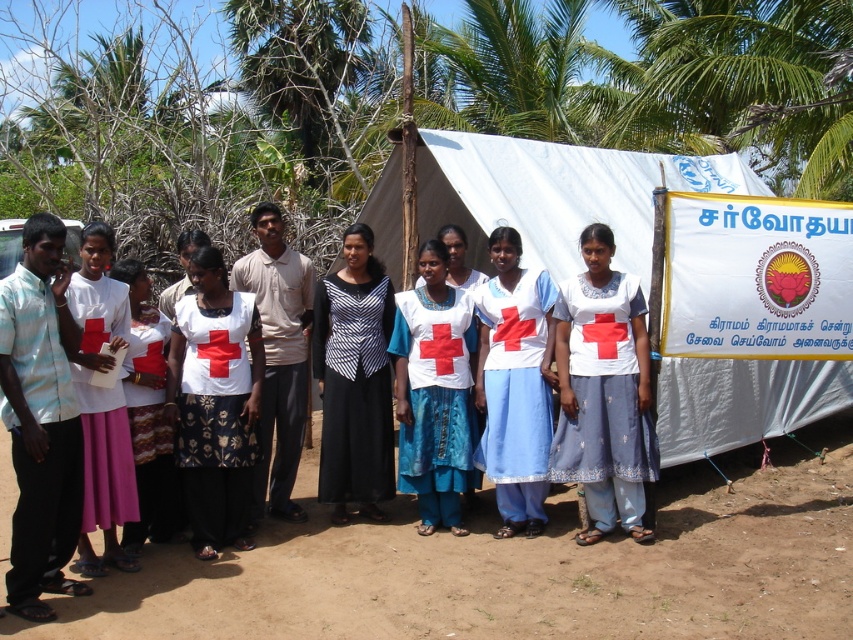
Can you confirm if white cotton shirt at center is positioned to the right of white matte shirt at center?

Correct, you'll find white cotton shirt at center to the right of white matte shirt at center.

Where is `white cotton shirt at center`? white cotton shirt at center is located at coordinates (602, 392).

Is point (697, 568) farther from camera compared to point (242, 436)?

No.

Looking at this image, can you confirm if brown sandy ground at lower center is shorter than white printed shirt at center?

Yes.

What are the coordinates of `brown sandy ground at lower center` in the screenshot? It's located at (521, 568).

Does white fabric tent at center have a greater width compared to white matte shirt at center?

Yes, white fabric tent at center is wider than white matte shirt at center.

In the scene shown: Who is lower down, white fabric tent at center or white matte shirt at center?

white matte shirt at center

Who is more forward, (625, 269) or (421, 460)?

Positioned in front is point (421, 460).

This screenshot has height=640, width=853. I want to click on white fabric tent at center, so click(x=556, y=193).